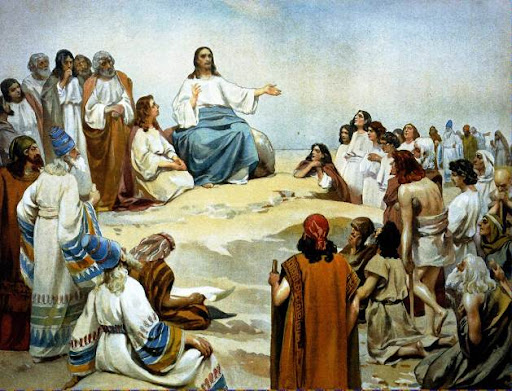
In order to click on blue drape in this screenshot , I will do `click(213, 131)`.